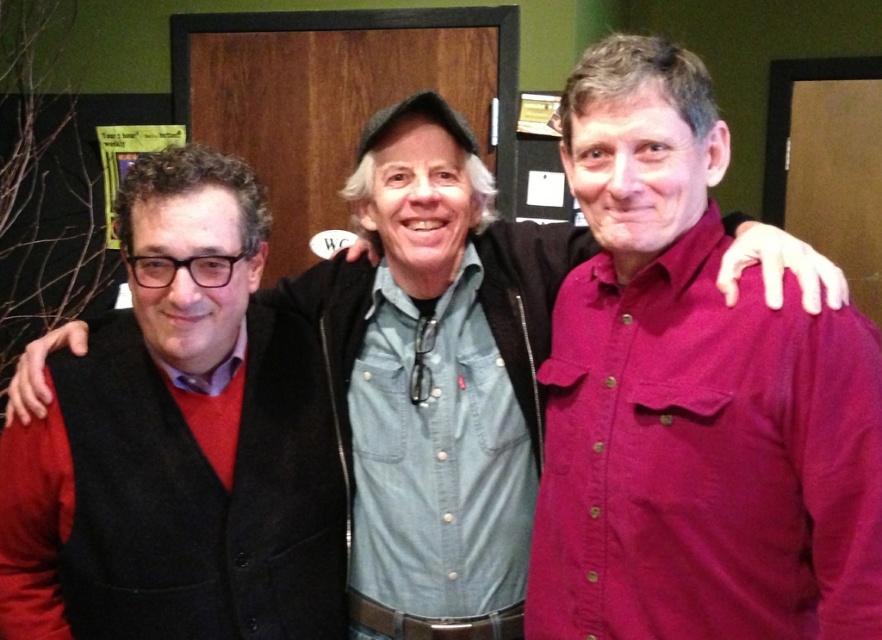
Is matte burgundy shirt at center thinner than matte black vest at left?

Indeed, matte burgundy shirt at center has a lesser width compared to matte black vest at left.

Between matte burgundy shirt at center and matte black vest at left, which one appears on the left side from the viewer's perspective?

matte black vest at left

Describe the element at coordinates (692, 397) in the screenshot. I see `matte burgundy shirt at center` at that location.

Where is `matte burgundy shirt at center`? The width and height of the screenshot is (882, 640). matte burgundy shirt at center is located at coordinates (692, 397).